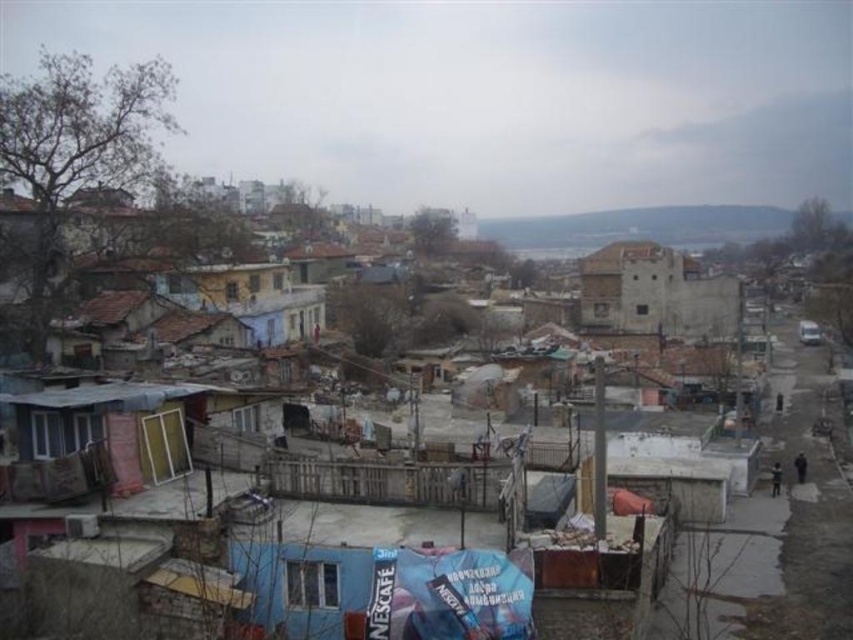
Is wooden planks hut at lower left to the left of weathered stone building at center from the viewer's perspective?

Correct, you'll find wooden planks hut at lower left to the left of weathered stone building at center.

Based on the photo, between wooden planks hut at lower left and weathered stone building at center, which one appears on the right side from the viewer's perspective?

Positioned to the right is weathered stone building at center.

The width and height of the screenshot is (853, 640). What do you see at coordinates (111, 428) in the screenshot? I see `wooden planks hut at lower left` at bounding box center [111, 428].

You are a GUI agent. You are given a task and a screenshot of the screen. Output one action in this format:
    pyautogui.click(x=<x>, y=<y>)
    Task: Click on the wooden planks hut at lower left
    This screenshot has height=640, width=853.
    Given the screenshot: What is the action you would take?
    tap(111, 428)